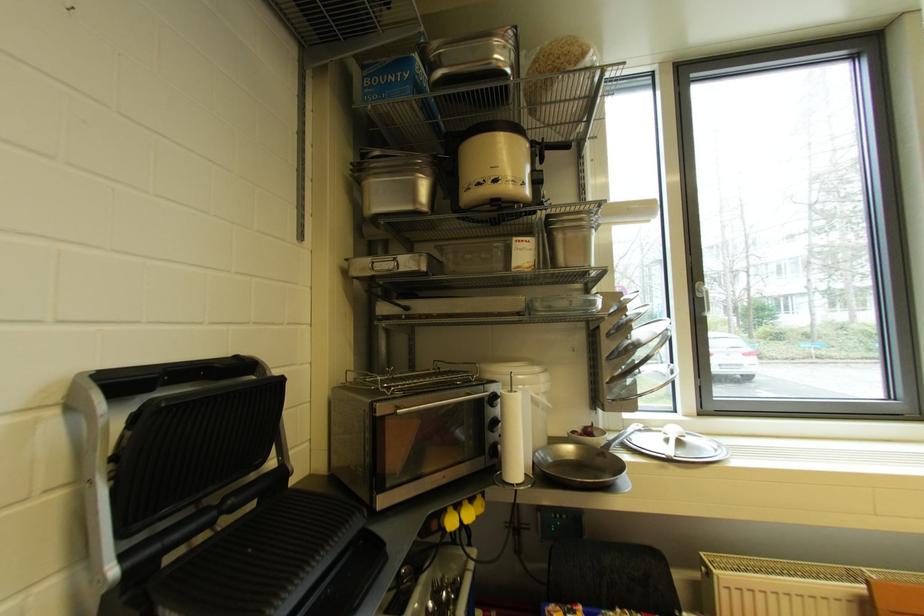
The height and width of the screenshot is (616, 924). What do you see at coordinates (582, 463) in the screenshot?
I see `a frying pan handle` at bounding box center [582, 463].